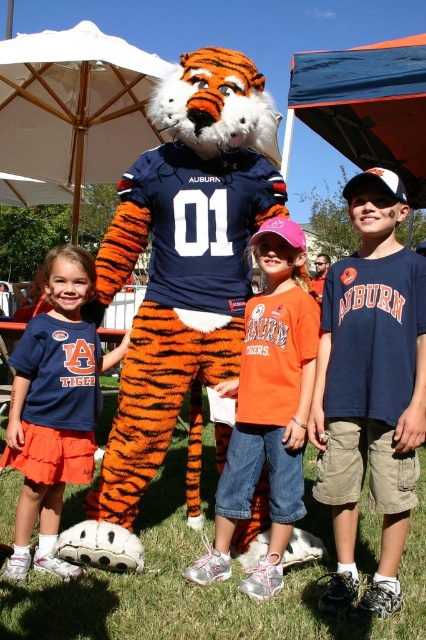
Does blue cotton shirt at center have a lesser width compared to orange cotton shirt at center?

Yes.

Which is more to the right, blue cotton shirt at center or orange cotton shirt at center?

From the viewer's perspective, blue cotton shirt at center appears more on the right side.

Is point (359, 256) behind point (230, 484)?

That is False.

Locate an element on the screen. blue cotton shirt at center is located at coordinates (371, 388).

Which of these two, orange cotton shirt at center or matte blue shirt at center, stands taller?

orange cotton shirt at center

Where is `orange cotton shirt at center`? The image size is (426, 640). orange cotton shirt at center is located at coordinates (267, 410).

Who is more distant from viewer, (239, 448) or (92, 284)?

Point (92, 284)

Find the location of a particular element. The width and height of the screenshot is (426, 640). orange cotton shirt at center is located at coordinates (267, 410).

Measure the distance from orange tiger costume at center to matte blue shirt at center.

A distance of 17.31 inches exists between orange tiger costume at center and matte blue shirt at center.

How distant is orange tiger costume at center from matte blue shirt at center?

17.31 inches

Find the location of a particular element. Image resolution: width=426 pixels, height=640 pixels. orange tiger costume at center is located at coordinates (178, 275).